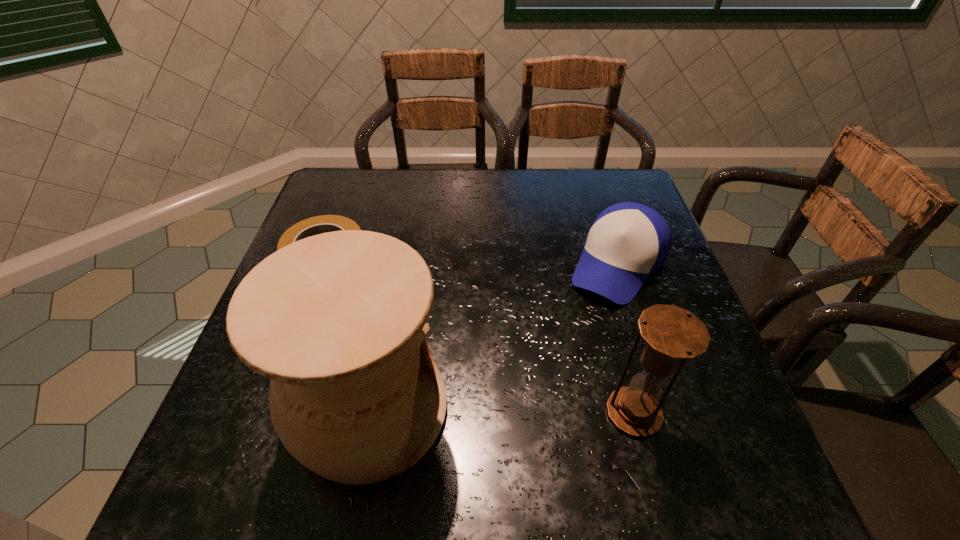
Where is `vacant area at the far edge`? This screenshot has width=960, height=540. vacant area at the far edge is located at coordinates (383, 180).

This screenshot has height=540, width=960. I want to click on free space at the near edge of the desktop, so click(x=486, y=427).

At what (x,y) coordinates should I click in order to perform the action: click on free space at the right edge of the desktop. Please return your answer as a coordinate pair (x, y). Looking at the image, I should click on (634, 315).

Where is `free space at the far left corner of the desktop`? This screenshot has width=960, height=540. free space at the far left corner of the desktop is located at coordinates (351, 191).

In the image, there is a desktop. What are the coordinates of `vacant space at the near left corner` in the screenshot? It's located at (228, 418).

In the image, there is a desktop. At what (x,y) coordinates should I click in order to perform the action: click on vacant space at the near right corner. Please return your answer as a coordinate pair (x, y). Looking at the image, I should click on tap(720, 403).

This screenshot has height=540, width=960. I want to click on vacant area that lies between the shortest object and the hourglass, so click(x=481, y=338).

This screenshot has width=960, height=540. What are the coordinates of `free space between the pottery and the baseball cap` in the screenshot? It's located at (494, 338).

The width and height of the screenshot is (960, 540). In order to click on free space between the second shortest object and the third shortest object in this screenshot , I will do `click(626, 339)`.

At what (x,y) coordinates should I click in order to perform the action: click on free area in between the tallest object and the second tallest object. Please return your answer as a coordinate pair (x, y). Looking at the image, I should click on (502, 411).